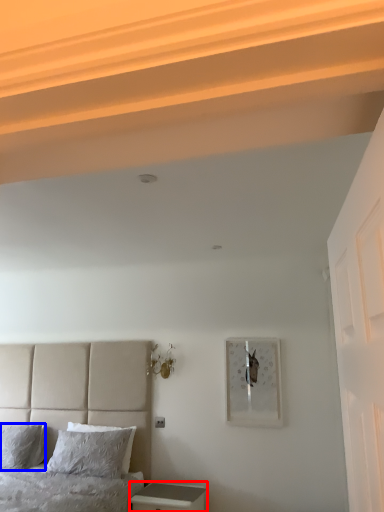
Question: Which point is closer to the camera, nightstand (highlighted by a red box) or pillow (highlighted by a blue box)?

Choices:
 (A) nightstand
 (B) pillow

Answer: (A)